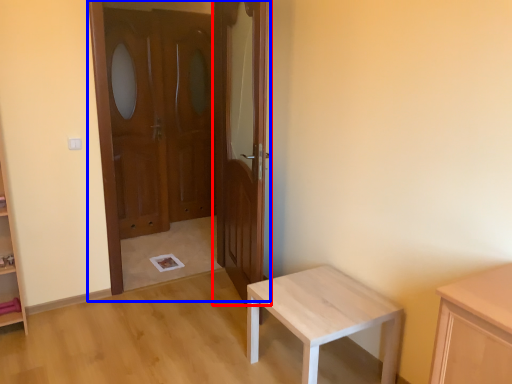
Question: Among these objects, which one is farthest to the camera, door (highlighted by a red box) or door (highlighted by a blue box)?

Choices:
 (A) door
 (B) door

Answer: (B)